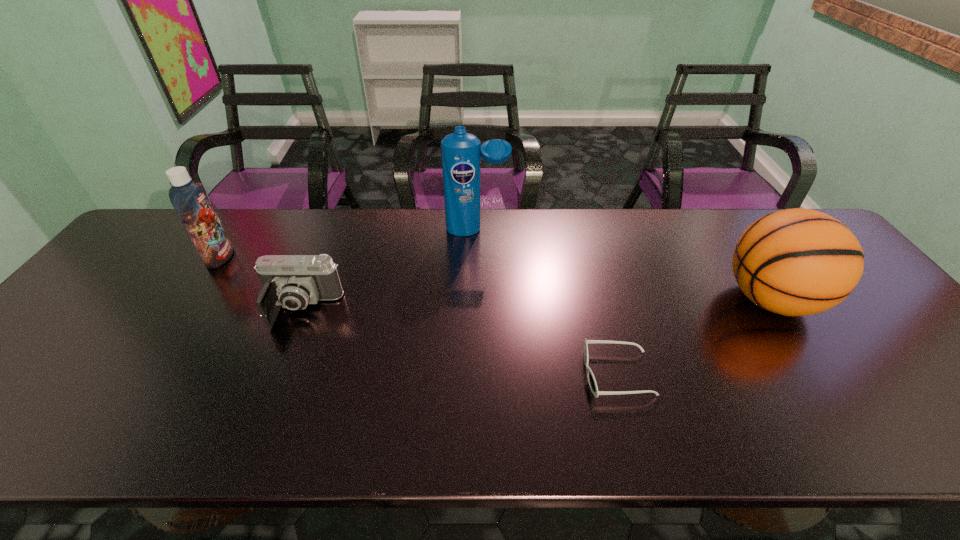
At what (x,y) coordinates should I click in order to perform the action: click on free location at the right edge. Please return your answer as a coordinate pair (x, y). Looking at the image, I should click on (893, 399).

The image size is (960, 540). I want to click on free space that is in between the fourth object from left to right and the shorter shampoo, so [419, 315].

What are the coordinates of `vacant point located between the basketball and the nearer shampoo` in the screenshot? It's located at pyautogui.click(x=495, y=278).

Image resolution: width=960 pixels, height=540 pixels. What are the coordinates of `vacant space that is in between the tallest object and the rightmost object` in the screenshot? It's located at (623, 265).

At what (x,y) coordinates should I click in order to perform the action: click on vacant space that is in between the nearer shampoo and the basketball. Please return your answer as a coordinate pair (x, y). Looking at the image, I should click on (495, 278).

You are a GUI agent. You are given a task and a screenshot of the screen. Output one action in this format:
    pyautogui.click(x=<x>, y=<y>)
    Task: Click on the free area in between the second object from left to right and the leftmost object
    This screenshot has height=540, width=960.
    Given the screenshot: What is the action you would take?
    pyautogui.click(x=260, y=284)

Find the location of `vacant space in between the taller shampoo and the fourth object from left to right`. vacant space in between the taller shampoo and the fourth object from left to right is located at coordinates (547, 302).

Image resolution: width=960 pixels, height=540 pixels. Identify the location of vacant area that lies between the camera and the right shampoo. (389, 269).

Identify the location of blank region between the second shortest object and the basketball. This screenshot has width=960, height=540. (536, 304).

Find the location of a particular element. empty location between the third object from left to right and the second shortest object is located at coordinates pos(389,269).